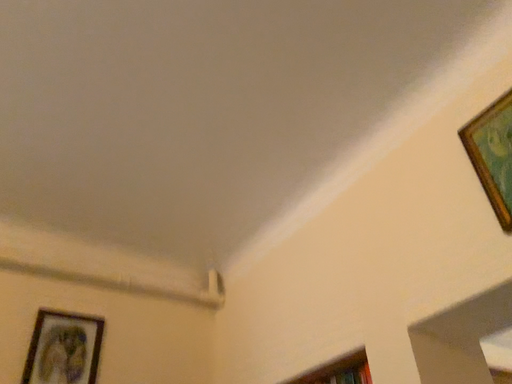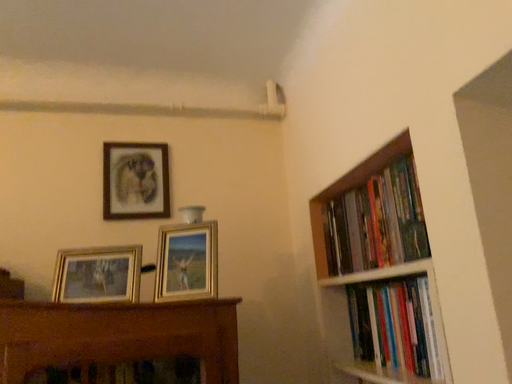
Question: How did the camera likely rotate when shooting the video?

Choices:
 (A) rotated right
 (B) rotated left

Answer: (B)